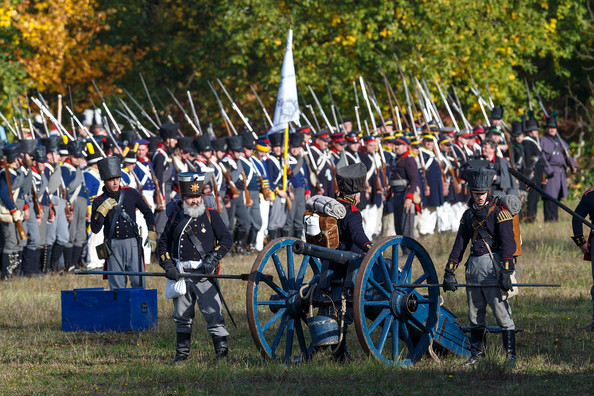
Identify the location of bucket. The height and width of the screenshot is (396, 594). 323,331.